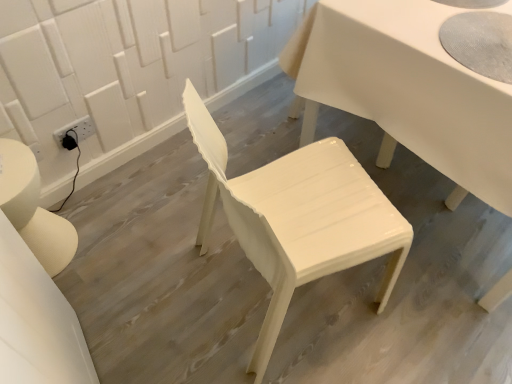
In order to click on free space to the right of glossy white chair at center in this screenshot , I will do `click(425, 299)`.